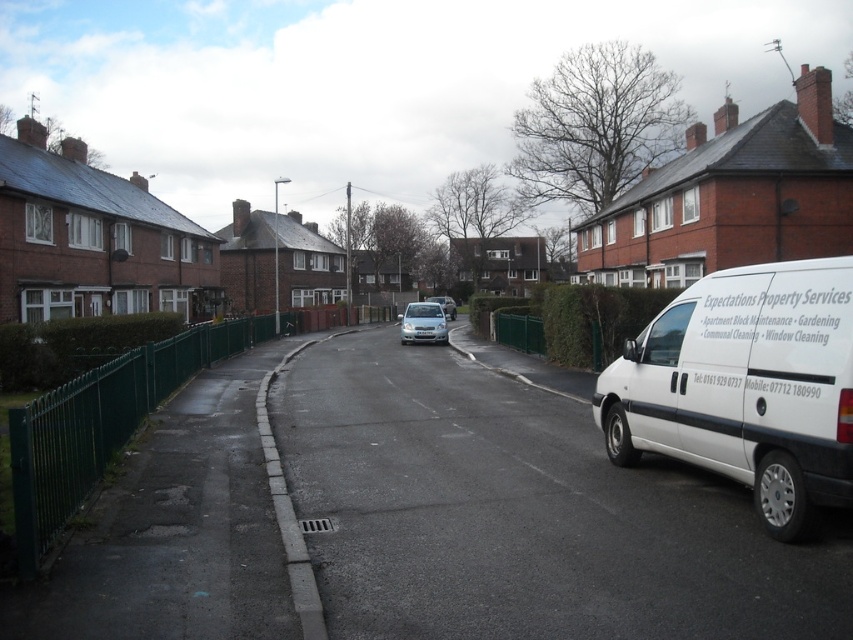
Is satin silver car at center further to camera compared to white plastic license plate at center?

Yes, it is behind white plastic license plate at center.

The image size is (853, 640). I want to click on satin silver car at center, so click(x=422, y=323).

Who is shorter, white matte van at right or satin silver car at center?

Standing shorter between the two is white matte van at right.

Does white matte van at right have a lesser height compared to satin silver car at center?

Correct, white matte van at right is not as tall as satin silver car at center.

Is point (779, 520) behind point (415, 308)?

That is False.

Identify the location of white matte van at right. The image size is (853, 640). (746, 387).

Can you confirm if white matte van at right is bigger than white plastic license plate at center?

Incorrect, white matte van at right is not larger than white plastic license plate at center.

Between white matte van at right and white plastic license plate at center, which one has less height?

Standing shorter between the two is white matte van at right.

Does point (703, 372) come farther from viewer compared to point (428, 337)?

No.

Locate an element on the screen. white matte van at right is located at coordinates (746, 387).